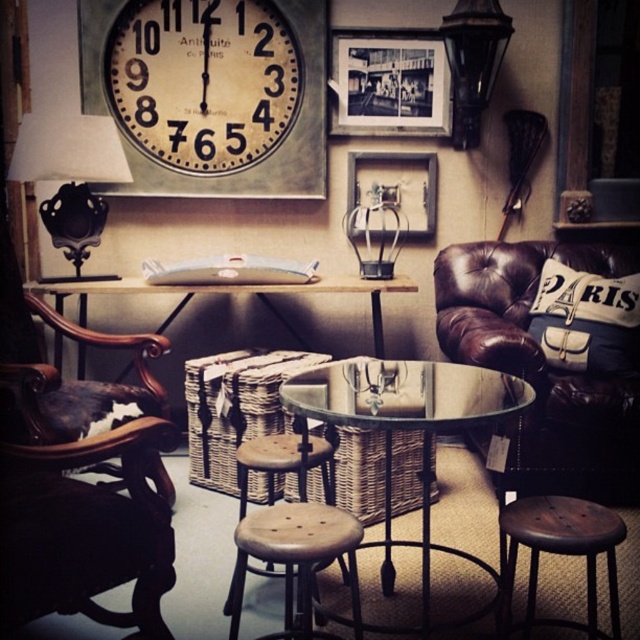
Does canvas paris pillow at right have a greater height compared to brown wooden stool at lower right?

Correct, canvas paris pillow at right is much taller as brown wooden stool at lower right.

Which is above, canvas paris pillow at right or brown wooden stool at lower right?

canvas paris pillow at right is above.

Is point (604, 368) farther from viewer compared to point (532, 538)?

Yes.

Find the location of a particular element. This screenshot has width=640, height=640. canvas paris pillow at right is located at coordinates (586, 320).

Who is higher up, vintage cream clock at upper center or canvas paris pillow at right?

vintage cream clock at upper center is above.

Which is in front, point (284, 90) or point (616, 300)?

Point (616, 300)

Who is more distant from viewer, (209, 173) or (637, 314)?

The point (209, 173) is behind.

Find the location of a particular element. vintage cream clock at upper center is located at coordinates (202, 81).

Measure the distance between canvas paris pillow at right and camera.

canvas paris pillow at right is 2.56 meters from camera.

Does point (548, 344) lie in front of point (484, 1)?

Yes, point (548, 344) is in front of point (484, 1).

Does point (538, 288) come behind point (458, 12)?

Yes, point (538, 288) is behind point (458, 12).

Locate an element on the screen. The image size is (640, 640). canvas paris pillow at right is located at coordinates (586, 320).